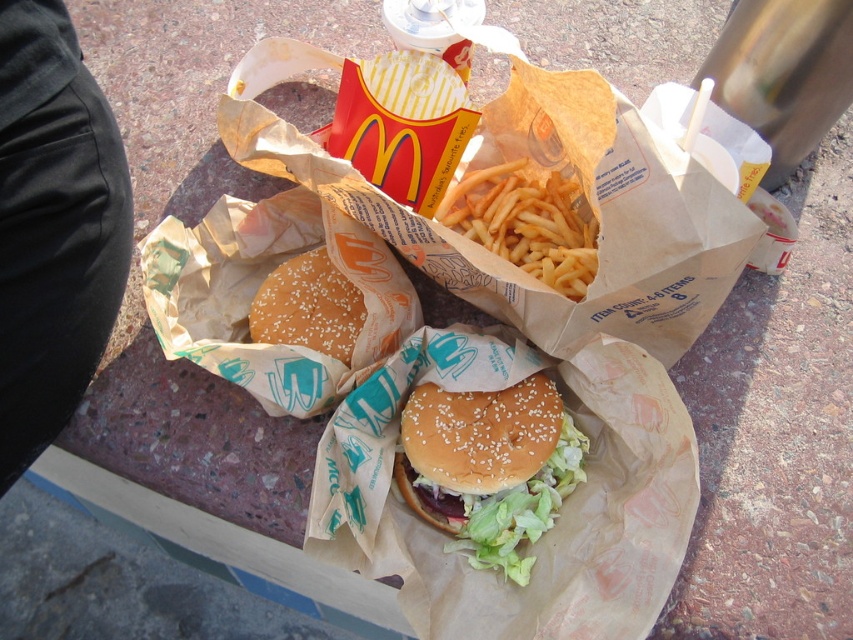
Between semi-glossy sesame seed bun at center and golden crispy french fries at center, which one appears on the left side from the viewer's perspective?

semi-glossy sesame seed bun at center

Looking at this image, does semi-glossy sesame seed bun at center appear on the left side of golden crispy french fries at center?

Yes, semi-glossy sesame seed bun at center is to the left of golden crispy french fries at center.

I want to click on semi-glossy sesame seed bun at center, so click(490, 467).